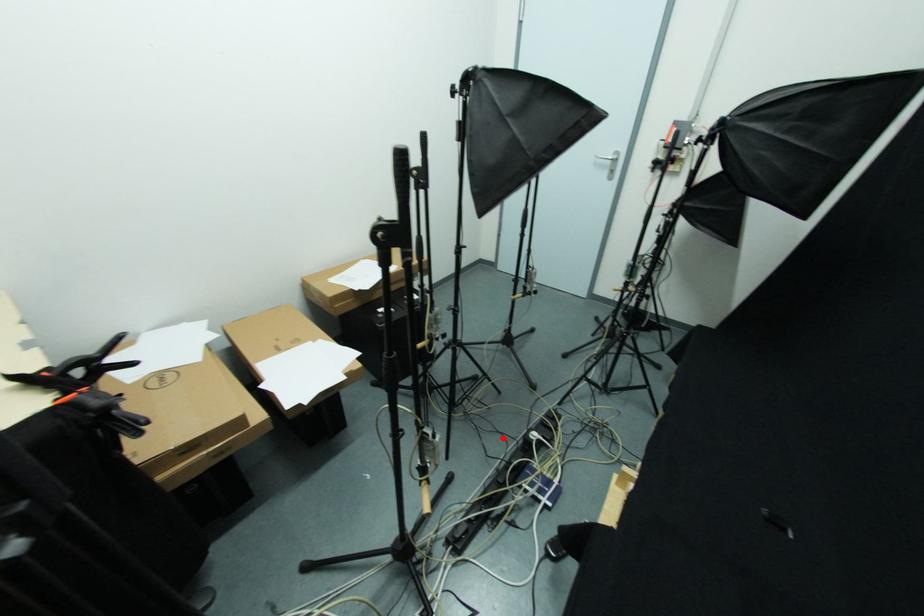
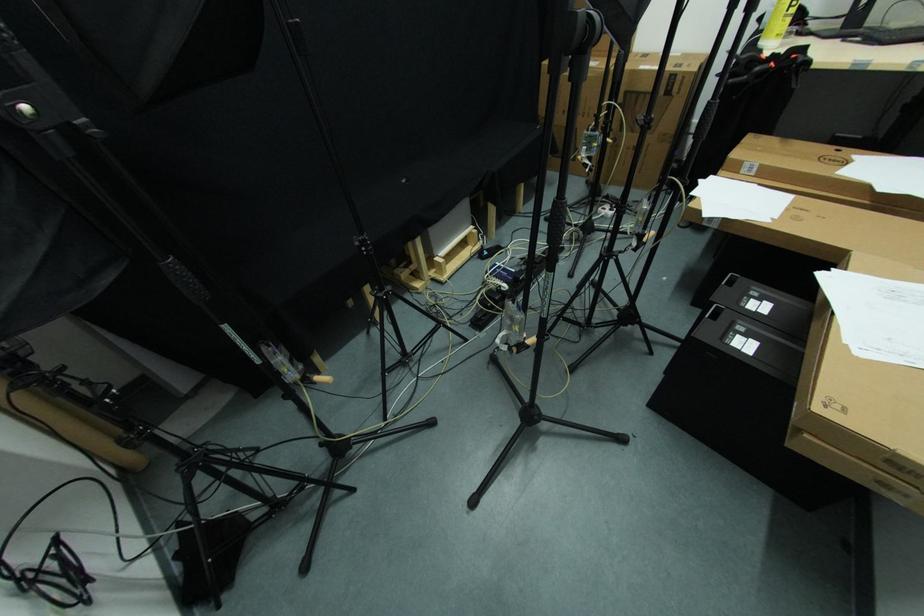
Question: I am providing you with two images of the same scene from different viewpoints. A red point is shown in image1. For the corresponding object point in image2, is it positioned nearer or farther from the camera?

Choices:
 (A) Nearer
 (B) Farther

Answer: (B)